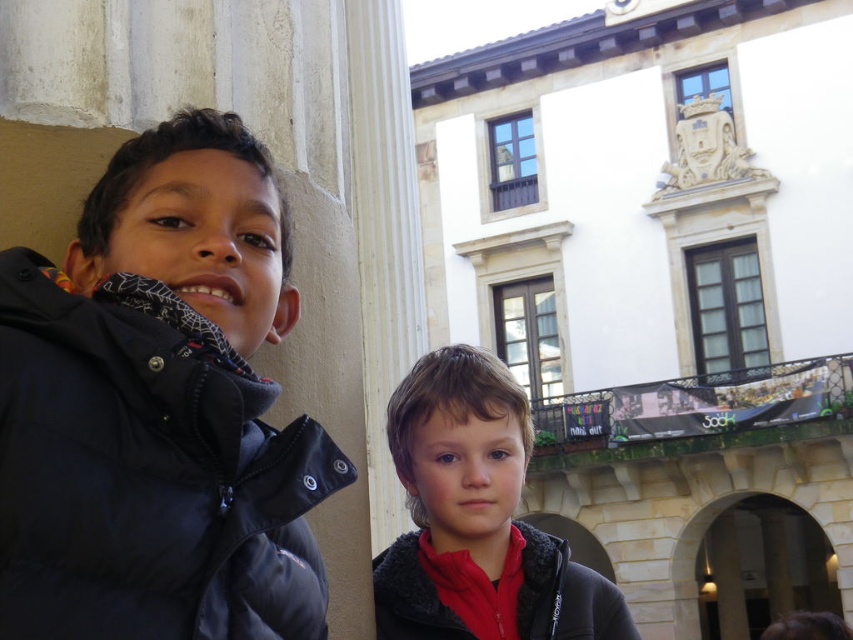
Question: Which point is farther to the camera?

Choices:
 (A) (142, 417)
 (B) (514, 522)
 (C) (424, 577)

Answer: (B)

Question: Which of the following is the closest to the observer?

Choices:
 (A) red fleece jacket at center
 (B) red fleece jacket at lower right

Answer: (B)

Question: Which of the following is the closest to the observer?

Choices:
 (A) red fleece jacket at lower right
 (B) red fleece jacket at center

Answer: (A)

Question: Is matte black jacket at left positioned at the back of red fleece jacket at center?

Choices:
 (A) no
 (B) yes

Answer: (A)

Question: Does red fleece jacket at center come in front of red fleece jacket at lower right?

Choices:
 (A) no
 (B) yes

Answer: (A)

Question: Is matte black jacket at left positioned before red fleece jacket at center?

Choices:
 (A) yes
 (B) no

Answer: (A)